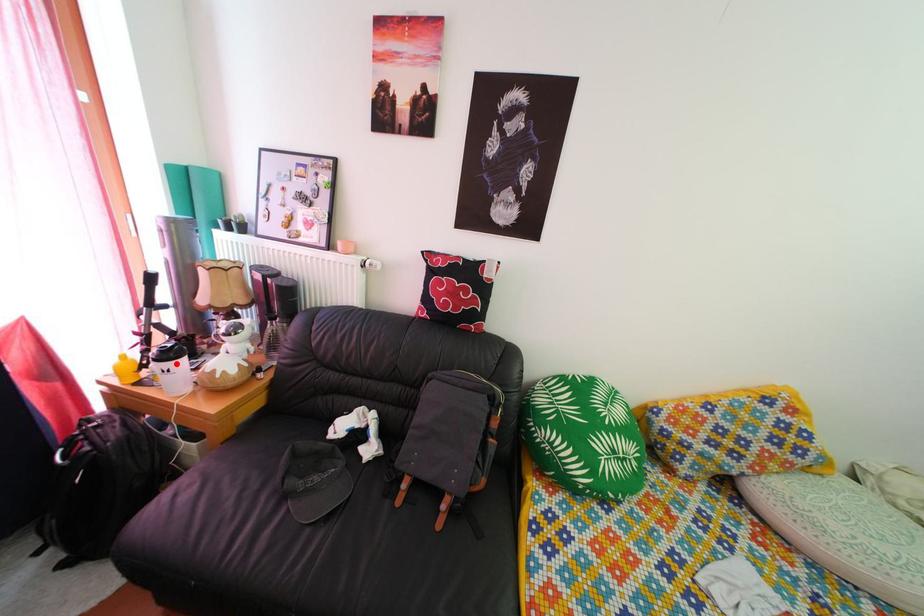
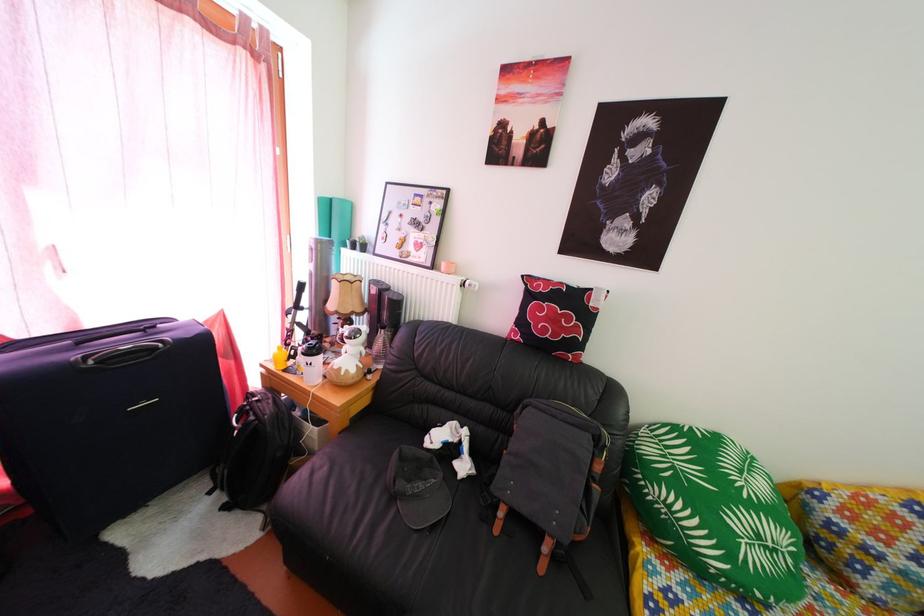
Question: I am providing you with two images of the same scene from different viewpoints. A red point is marked on the first image. At the location where the point appears in image 1, is it still visible in image 2?

Choices:
 (A) Yes
 (B) No

Answer: (A)